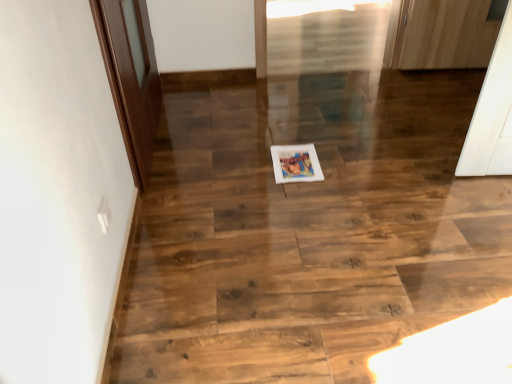
The height and width of the screenshot is (384, 512). What are the coordinates of `free point behind matte paper postcard at center` in the screenshot? It's located at (294, 135).